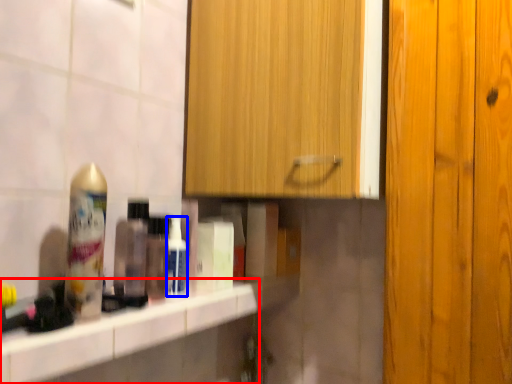
Question: Among these objects, which one is farthest to the camera, counter top (highlighted by a red box) or mouthwash (highlighted by a blue box)?

Choices:
 (A) counter top
 (B) mouthwash

Answer: (B)